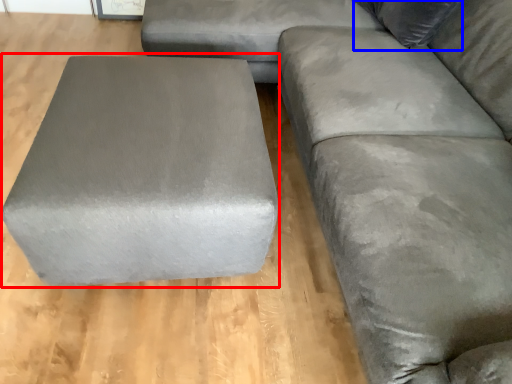
Question: Which point is closer to the camera, stool (highlighted by a red box) or pillow (highlighted by a blue box)?

Choices:
 (A) stool
 (B) pillow

Answer: (A)